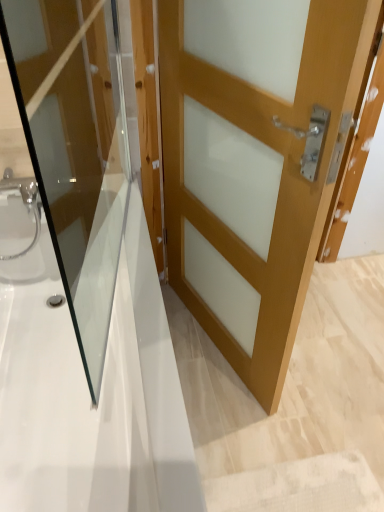
Describe the element at coordinates (254, 161) in the screenshot. This screenshot has width=384, height=512. I see `light brown wood door at center, which ranks as the 2th door in left-to-right order` at that location.

I want to click on light brown wood door at center, the first door in the right-to-left sequence, so click(x=254, y=161).

From a real-world perspective, relative to light brown wood door at center, the first door in the right-to-left sequence, is white glossy bathtub at center vertically above or below?

white glossy bathtub at center is below light brown wood door at center, the first door in the right-to-left sequence.

Is white glossy bathtub at center far from light brown wood door at center, the first door in the right-to-left sequence?

No.

From the image's perspective, which one is positioned lower, white glossy bathtub at center or light brown wood door at center, the first door in the right-to-left sequence?

From the image's view, white glossy bathtub at center is below.

Is white glossy bathtub at center positioned beyond the bounds of matte wood door at center, which appears as the second door when viewed from the right?

Yes, white glossy bathtub at center is located beyond the bounds of matte wood door at center, which appears as the second door when viewed from the right.

From the picture: Are white glossy bathtub at center and matte wood door at center, placed as the first door when sorted from left to right, far apart?

That's not correct — white glossy bathtub at center is a little close to matte wood door at center, placed as the first door when sorted from left to right.

Which object is thinner, white glossy bathtub at center or matte wood door at center, placed as the first door when sorted from left to right?

matte wood door at center, placed as the first door when sorted from left to right.

Is white glossy bathtub at center closer to the viewer compared to matte wood door at center, which appears as the second door when viewed from the right?

No, it is not.

Is matte wood door at center, which appears as the second door when viewed from the right, at the left side of white glossy bathtub at center?

No.

Would you consider matte wood door at center, which appears as the second door when viewed from the right, to be distant from white glossy bathtub at center?

No, matte wood door at center, which appears as the second door when viewed from the right, is not far from white glossy bathtub at center.

Choose the correct answer: Is matte wood door at center, which appears as the second door when viewed from the right, inside white glossy bathtub at center or outside it?

matte wood door at center, which appears as the second door when viewed from the right, exists outside the volume of white glossy bathtub at center.

Considering the relative positions of matte wood door at center, placed as the first door when sorted from left to right, and white glossy bathtub at center in the image provided, is matte wood door at center, placed as the first door when sorted from left to right, in front of white glossy bathtub at center?

Yes, it is in front of white glossy bathtub at center.

What's the angular difference between light brown wood door at center, the first door in the right-to-left sequence, and white glossy bathtub at center's facing directions?

18 degrees separate the facing orientations of light brown wood door at center, the first door in the right-to-left sequence, and white glossy bathtub at center.

From a real-world perspective, which is physically below, light brown wood door at center, the first door in the right-to-left sequence, or white glossy bathtub at center?

In real-world perspective, white glossy bathtub at center is lower.

Which is more distant, [277,394] or [86,490]?

The point [277,394] is behind.

Is light brown wood door at center, the first door in the right-to-left sequence, outside of white glossy bathtub at center?

Absolutely, light brown wood door at center, the first door in the right-to-left sequence, is external to white glossy bathtub at center.

Is light brown wood door at center, which ranks as the 2th door in left-to-right order, beside matte wood door at center, which appears as the second door when viewed from the right?

No, light brown wood door at center, which ranks as the 2th door in left-to-right order, is not in contact with matte wood door at center, which appears as the second door when viewed from the right.

Does point (300, 40) lie behind point (32, 67)?

That is False.

Which object is more forward, light brown wood door at center, the first door in the right-to-left sequence, or matte wood door at center, which appears as the second door when viewed from the right?

matte wood door at center, which appears as the second door when viewed from the right, is closer to the camera.

Based on their sizes in the image, would you say matte wood door at center, placed as the first door when sorted from left to right, is bigger or smaller than light brown wood door at center, the first door in the right-to-left sequence?

Considering their sizes, matte wood door at center, placed as the first door when sorted from left to right, takes up less space than light brown wood door at center, the first door in the right-to-left sequence.

From the image's perspective, does matte wood door at center, placed as the first door when sorted from left to right, appear higher than light brown wood door at center, the first door in the right-to-left sequence?

Yes, from the image's perspective, matte wood door at center, placed as the first door when sorted from left to right, is on top of light brown wood door at center, the first door in the right-to-left sequence.

In the scene shown: Which of these two, matte wood door at center, which appears as the second door when viewed from the right, or light brown wood door at center, the first door in the right-to-left sequence, is wider?

With larger width is light brown wood door at center, the first door in the right-to-left sequence.

Choose the correct answer: Is matte wood door at center, which appears as the second door when viewed from the right, inside light brown wood door at center, the first door in the right-to-left sequence, or outside it?

matte wood door at center, which appears as the second door when viewed from the right, is outside light brown wood door at center, the first door in the right-to-left sequence.

You are a GUI agent. You are given a task and a screenshot of the screen. Output one action in this format:
    pyautogui.click(x=<x>, y=<y>)
    Task: Click on the 2nd door counting from the right of the white glossy bathtub at center
    
    Given the screenshot: What is the action you would take?
    pyautogui.click(x=254, y=161)

Where is `door that is the 2nd object located above the white glossy bathtub at center (from the image's perspective)`? This screenshot has width=384, height=512. door that is the 2nd object located above the white glossy bathtub at center (from the image's perspective) is located at coordinates (75, 148).

Estimate the real-world distances between objects in this image. Which object is further from light brown wood door at center, the first door in the right-to-left sequence, white glossy bathtub at center or matte wood door at center, which appears as the second door when viewed from the right?

Based on the image, white glossy bathtub at center appears to be further to light brown wood door at center, the first door in the right-to-left sequence.

Consider the image. From the image, which object appears to be farther from white glossy bathtub at center, light brown wood door at center, the first door in the right-to-left sequence, or matte wood door at center, which appears as the second door when viewed from the right?

light brown wood door at center, the first door in the right-to-left sequence, lies further to white glossy bathtub at center than the other object.

Based on their spatial positions, is light brown wood door at center, the first door in the right-to-left sequence, or white glossy bathtub at center further from matte wood door at center, which appears as the second door when viewed from the right?

light brown wood door at center, the first door in the right-to-left sequence, is further to matte wood door at center, which appears as the second door when viewed from the right.

Looking at the image, which one is located further to light brown wood door at center, the first door in the right-to-left sequence, matte wood door at center, which appears as the second door when viewed from the right, or white glossy bathtub at center?

white glossy bathtub at center is positioned further to the anchor light brown wood door at center, the first door in the right-to-left sequence.

From the picture: From the image, which object appears to be nearer to white glossy bathtub at center, matte wood door at center, which appears as the second door when viewed from the right, or light brown wood door at center, the first door in the right-to-left sequence?

Among the two, matte wood door at center, which appears as the second door when viewed from the right, is located nearer to white glossy bathtub at center.

Estimate the real-world distances between objects in this image. Which object is closer to matte wood door at center, which appears as the second door when viewed from the right, white glossy bathtub at center or light brown wood door at center, the first door in the right-to-left sequence?

white glossy bathtub at center lies closer to matte wood door at center, which appears as the second door when viewed from the right, than the other object.

Find the location of a particular element. door between matte wood door at center, placed as the first door when sorted from left to right, and white glossy bathtub at center, in the vertical direction is located at coordinates (254, 161).